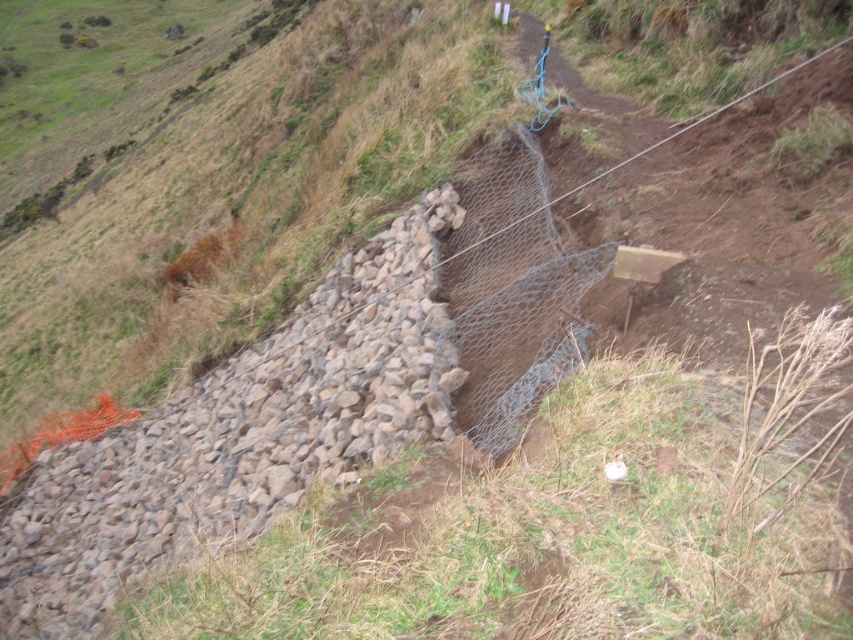
You are standing on the slope and want to cross from the left side to the right side. You see the wire mesh at center and the wire mesh fence at center. Which one should you step over first?

You should step over the wire mesh at center first because it is closer to the viewer than the wire mesh fence at center.

You are a construction worker on the slope and need to secure the loose stones on the left side. Which object, the wire mesh at center or the wire mesh fence at center, would you use to cover the stones effectively?

The wire mesh at center is smaller than the wire mesh fence at center, so the wire mesh fence at center would be more effective for covering the larger area of loose stones.

You are standing at the bottom of the slope and looking up. There are two points marked on the slope, point 1 at coordinates point (490, 208) and point 2 at coordinates point (593, 321). Which point is closer to you?

Point (490, 208) is closer to you because it is further to the viewer than point (593, 321).